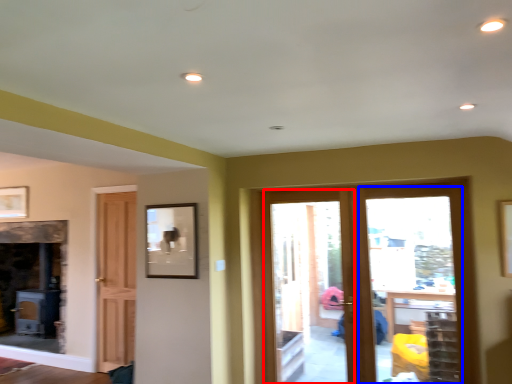
Question: Which of the following is the closest to the observer, screen door (highlighted by a red box) or glass door (highlighted by a blue box)?

Choices:
 (A) screen door
 (B) glass door

Answer: (B)